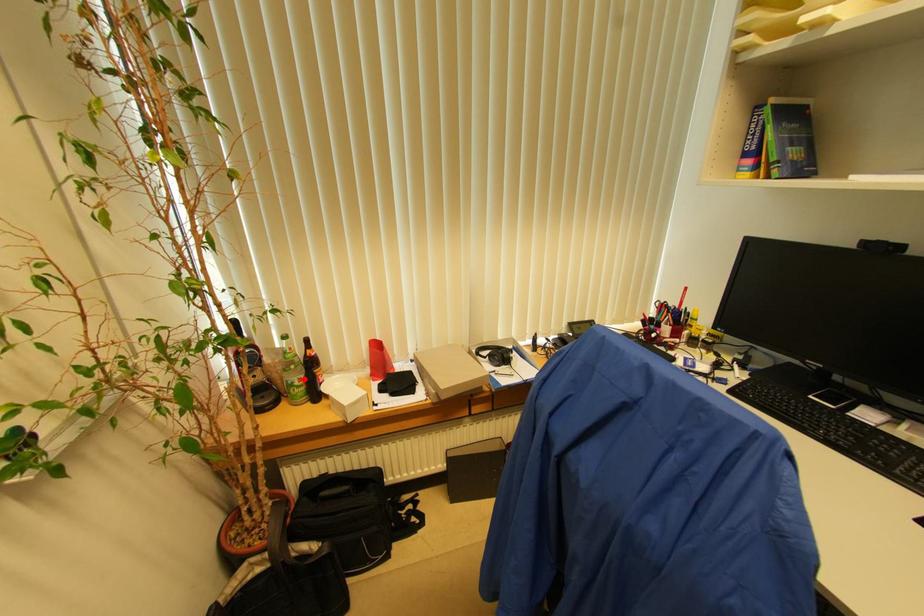
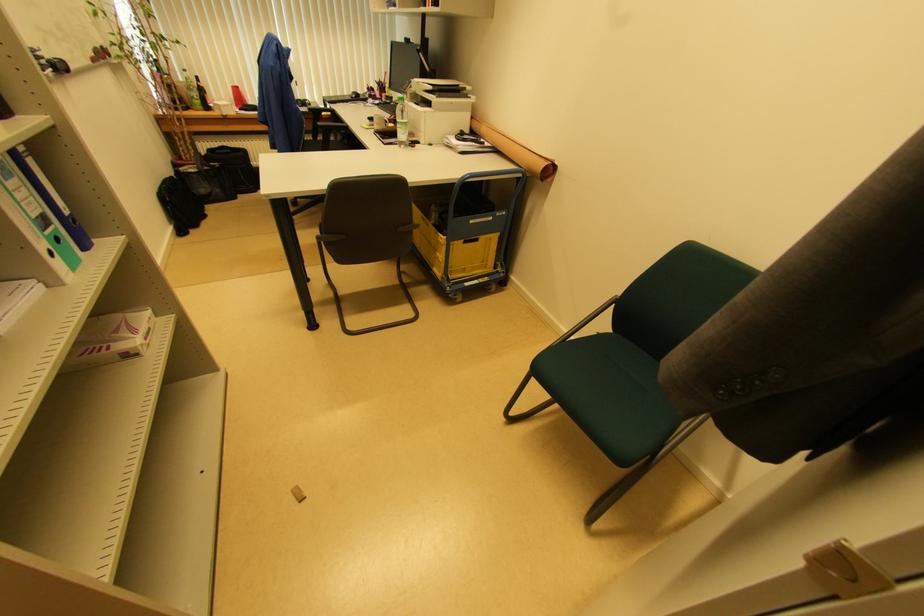
Question: I am providing you with two images of the same scene from different viewpoints. Given a red point in image1, look at the same physical point in image2. Is it:

Choices:
 (A) Closer to the viewpoint
 (B) Farther from the viewpoint

Answer: (B)